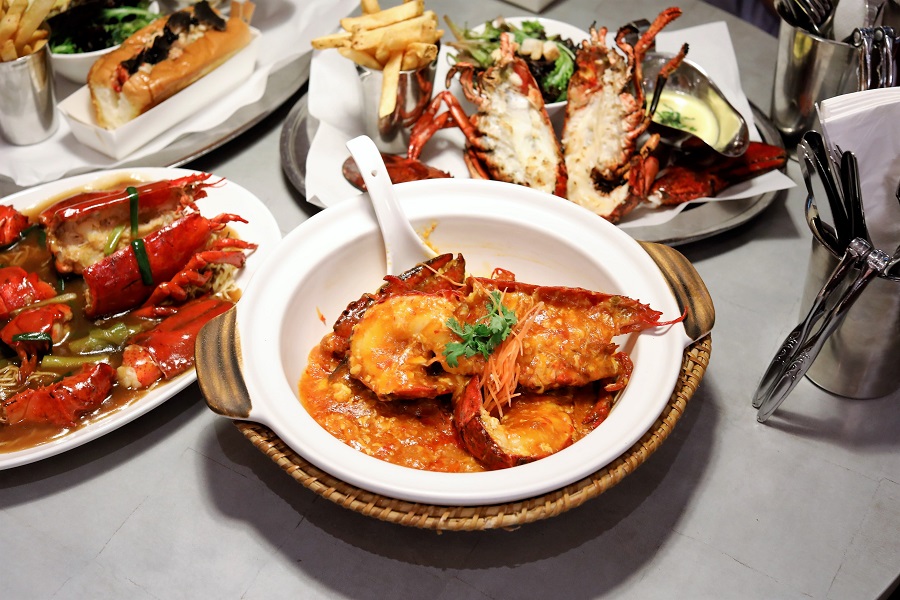
Where is `table`? Image resolution: width=900 pixels, height=600 pixels. table is located at coordinates (727, 526).